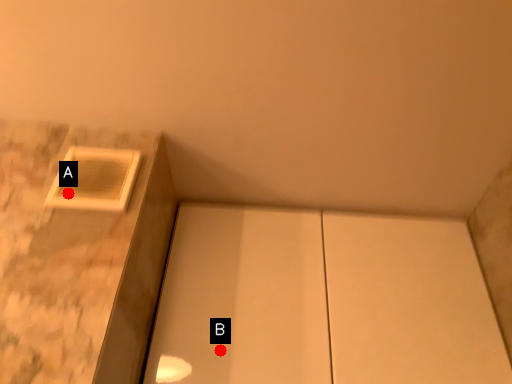
Question: Two points are circled on the image, labeled by A and B beside each circle. Which point appears closest to the camera in this image?

Choices:
 (A) A is closer
 (B) B is closer

Answer: (A)